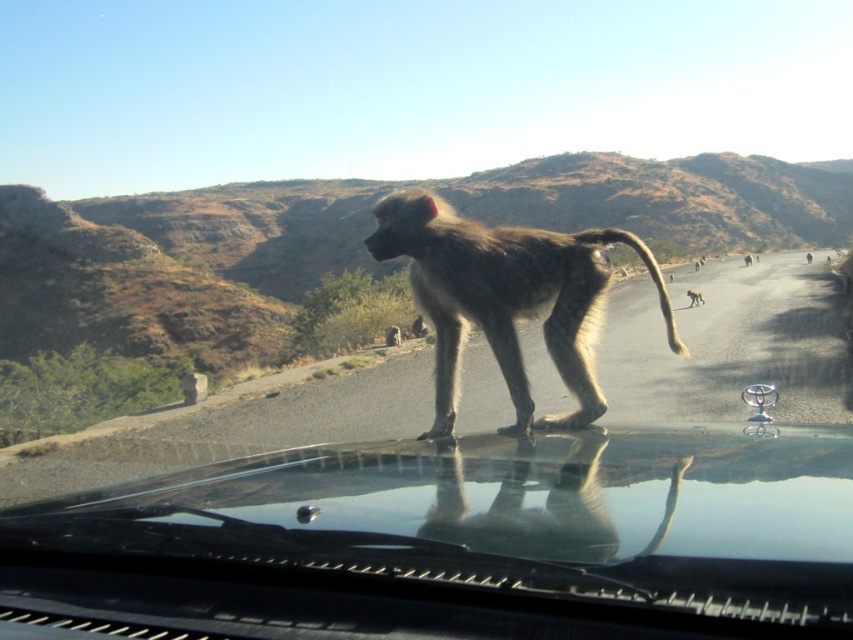
Consider the image. Measure the distance between transparent glass windshield at center and gray fur monkey at center.

transparent glass windshield at center is 1.77 meters away from gray fur monkey at center.

Which is below, transparent glass windshield at center or gray fur monkey at center?

Positioned lower is transparent glass windshield at center.

Find the location of a particular element. transparent glass windshield at center is located at coordinates (454, 541).

Can you confirm if transparent glass windshield at center is thinner than fuzzy brown monkey at center?

Incorrect, transparent glass windshield at center's width is not less than fuzzy brown monkey at center's.

In the scene shown: Does transparent glass windshield at center have a smaller size compared to fuzzy brown monkey at center?

Actually, transparent glass windshield at center might be larger than fuzzy brown monkey at center.

Does point (599, 564) lie behind point (698, 305)?

No.

Locate an element on the screen. transparent glass windshield at center is located at coordinates (454, 541).

Is gray fur monkey at center smaller than fuzzy brown monkey at center?

Incorrect, gray fur monkey at center is not smaller in size than fuzzy brown monkey at center.

Which of these two, gray fur monkey at center or fuzzy brown monkey at center, stands shorter?

fuzzy brown monkey at center

This screenshot has width=853, height=640. What do you see at coordinates (506, 298) in the screenshot?
I see `gray fur monkey at center` at bounding box center [506, 298].

Locate an element on the screen. This screenshot has width=853, height=640. gray fur monkey at center is located at coordinates (506, 298).